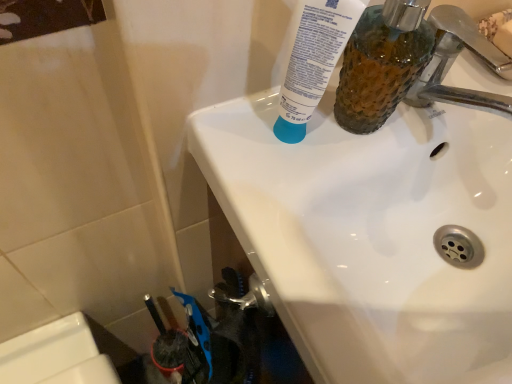
Describe the element at coordinates (371, 235) in the screenshot. This screenshot has height=384, width=512. I see `white glossy sink at upper center` at that location.

Locate an element on the screen. The image size is (512, 384). white matte tube at upper center is located at coordinates (313, 61).

Where is `chrome metallic faucet at upper right`? This screenshot has width=512, height=384. chrome metallic faucet at upper right is located at coordinates 453,62.

From the image's perspective, which one is positioned higher, white glossy sink at upper center or translucent textured mouthwash at upper right?

translucent textured mouthwash at upper right.

From a real-world perspective, is white glossy sink at upper center located higher than translucent textured mouthwash at upper right?

Incorrect, from a real-world perspective, white glossy sink at upper center is lower than translucent textured mouthwash at upper right.

Do you think white glossy sink at upper center is within translucent textured mouthwash at upper right, or outside of it?

white glossy sink at upper center lies outside translucent textured mouthwash at upper right.

This screenshot has height=384, width=512. Identify the location of mouthwash on the left of white glossy sink at upper center. (382, 63).

Considering the relative sizes of translucent textured mouthwash at upper right and white glossy sink at upper center in the image provided, is translucent textured mouthwash at upper right taller than white glossy sink at upper center?

Correct, translucent textured mouthwash at upper right is much taller as white glossy sink at upper center.

Can you tell me how much translucent textured mouthwash at upper right and white glossy sink at upper center differ in facing direction?

0.000526 degrees separate the facing orientations of translucent textured mouthwash at upper right and white glossy sink at upper center.

Does translucent textured mouthwash at upper right have a smaller size compared to white glossy sink at upper center?

Indeed, translucent textured mouthwash at upper right has a smaller size compared to white glossy sink at upper center.

From a real-world perspective, is translucent textured mouthwash at upper right on white glossy sink at upper center?

Indeed, from a real-world perspective, translucent textured mouthwash at upper right stands above white glossy sink at upper center.

Based on the photo, which of these two, chrome metallic faucet at upper right or white glossy sink at upper center, is wider?

Wider between the two is white glossy sink at upper center.

Measure the distance from chrome metallic faucet at upper right to white glossy sink at upper center.

5.68 inches.

Is chrome metallic faucet at upper right in front of or behind white glossy sink at upper center in the image?

chrome metallic faucet at upper right is positioned farther from the viewer than white glossy sink at upper center.

In the scene shown: Does chrome metallic faucet at upper right have a lesser height compared to white glossy sink at upper center?

Yes, chrome metallic faucet at upper right is shorter than white glossy sink at upper center.

Looking at the image, does white matte tube at upper center seem bigger or smaller compared to translucent textured mouthwash at upper right?

Considering their sizes, white matte tube at upper center takes up less space than translucent textured mouthwash at upper right.

Is white matte tube at upper center positioned with its back to translucent textured mouthwash at upper right?

No.

Which of these two, white matte tube at upper center or translucent textured mouthwash at upper right, is wider?

translucent textured mouthwash at upper right.

From their relative heights in the image, would you say white matte tube at upper center is taller or shorter than translucent textured mouthwash at upper right?

Clearly, white matte tube at upper center is shorter compared to translucent textured mouthwash at upper right.

This screenshot has height=384, width=512. What are the coordinates of `mouthwash in front of the white matte tube at upper center` in the screenshot? It's located at (382, 63).

How different are the orientations of translucent textured mouthwash at upper right and white matte tube at upper center in degrees?

0.0047 degrees.

Is translucent textured mouthwash at upper right far from white matte tube at upper center?

translucent textured mouthwash at upper right is actually quite close to white matte tube at upper center.

Is chrome metallic faucet at upper right at the left side of translucent textured mouthwash at upper right?

In fact, chrome metallic faucet at upper right is to the right of translucent textured mouthwash at upper right.

Is chrome metallic faucet at upper right aimed at translucent textured mouthwash at upper right?

No.

Is chrome metallic faucet at upper right far from translucent textured mouthwash at upper right?

No, chrome metallic faucet at upper right is not far from translucent textured mouthwash at upper right.

Based on the photo, from the image's perspective, is chrome metallic faucet at upper right on top of translucent textured mouthwash at upper right?

Yes, from the image's perspective, chrome metallic faucet at upper right is above translucent textured mouthwash at upper right.

Based on the photo, between white matte tube at upper center and white glossy sink at upper center, which one is positioned in front?

white glossy sink at upper center is in front.

Which object is positioned more to the right, white matte tube at upper center or white glossy sink at upper center?

white glossy sink at upper center.

How different are the orientations of white matte tube at upper center and white glossy sink at upper center in degrees?

0.00503 degrees.

This screenshot has width=512, height=384. I want to click on toothpaste located above the white glossy sink at upper center (from a real-world perspective), so click(313, 61).

Find the location of a particular element. sink lying in front of the translucent textured mouthwash at upper right is located at coordinates (371, 235).

The image size is (512, 384). In order to click on mouthwash behind the white glossy sink at upper center in this screenshot , I will do `click(382, 63)`.

Considering their positions, is chrome metallic faucet at upper right positioned further to white matte tube at upper center than translucent textured mouthwash at upper right?

chrome metallic faucet at upper right is further to white matte tube at upper center.

Based on their spatial positions, is translucent textured mouthwash at upper right or chrome metallic faucet at upper right further from white glossy sink at upper center?

chrome metallic faucet at upper right.

Looking at the image, which one is located further to white glossy sink at upper center, chrome metallic faucet at upper right or translucent textured mouthwash at upper right?

chrome metallic faucet at upper right.

Based on their spatial positions, is white matte tube at upper center or translucent textured mouthwash at upper right further from white glossy sink at upper center?

Among the two, white matte tube at upper center is located further to white glossy sink at upper center.

Looking at the image, which one is located closer to translucent textured mouthwash at upper right, chrome metallic faucet at upper right or white glossy sink at upper center?

chrome metallic faucet at upper right is closer to translucent textured mouthwash at upper right.

When comparing their distances from chrome metallic faucet at upper right, does white glossy sink at upper center or white matte tube at upper center seem further?

The object further to chrome metallic faucet at upper right is white matte tube at upper center.

Estimate the real-world distances between objects in this image. Which object is further from translucent textured mouthwash at upper right, white glossy sink at upper center or chrome metallic faucet at upper right?

white glossy sink at upper center lies further to translucent textured mouthwash at upper right than the other object.

From the image, which object appears to be nearer to white matte tube at upper center, chrome metallic faucet at upper right or white glossy sink at upper center?

white glossy sink at upper center.

The height and width of the screenshot is (384, 512). Identify the location of mouthwash situated between white matte tube at upper center and chrome metallic faucet at upper right from left to right. (382, 63).

The height and width of the screenshot is (384, 512). I want to click on mouthwash between white matte tube at upper center and white glossy sink at upper center from left to right, so [x=382, y=63].

The width and height of the screenshot is (512, 384). I want to click on sink between translucent textured mouthwash at upper right and chrome metallic faucet at upper right from left to right, so click(371, 235).

The width and height of the screenshot is (512, 384). I want to click on sink between white matte tube at upper center and chrome metallic faucet at upper right from left to right, so click(371, 235).